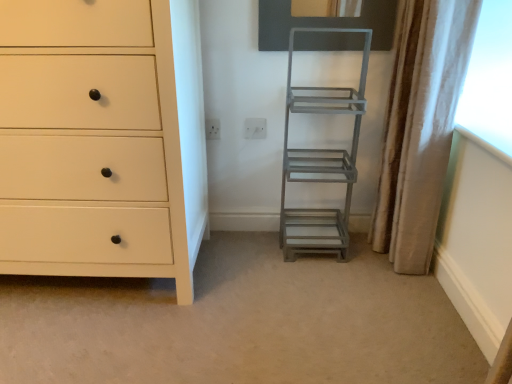
Identify the location of free space in front of beige fabric curtain at right. The height and width of the screenshot is (384, 512). (398, 290).